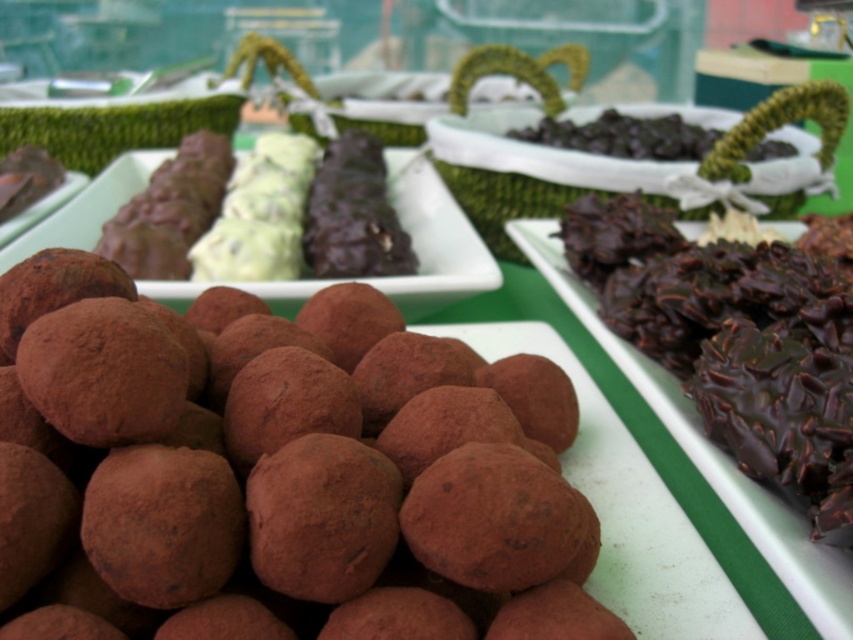
Question: Can you confirm if brown matte truffles at lower left is wider than chocolate-coated nuts at right?

Choices:
 (A) yes
 (B) no

Answer: (A)

Question: Which point is closer to the camera?

Choices:
 (A) (798, 419)
 (B) (194, 474)

Answer: (B)

Question: Which point is farther from the camera taking this photo?

Choices:
 (A) (56, 564)
 (B) (799, 314)

Answer: (B)

Question: Which point appears closest to the camera in this image?

Choices:
 (A) pyautogui.click(x=811, y=269)
 (B) pyautogui.click(x=546, y=497)

Answer: (B)

Question: Can you confirm if brown matte truffles at lower left is bigger than chocolate-coated nuts at right?

Choices:
 (A) no
 (B) yes

Answer: (A)

Question: Is brown matte truffles at lower left bigger than chocolate-coated nuts at right?

Choices:
 (A) no
 (B) yes

Answer: (A)